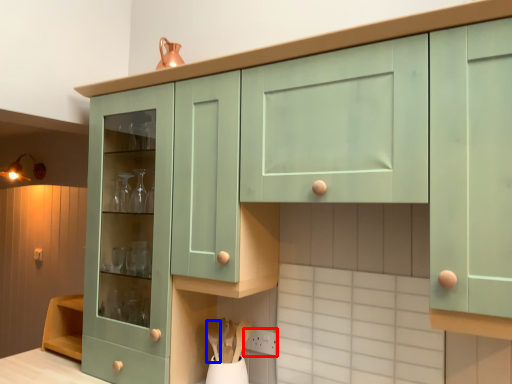
Question: Which point is further to the camera, power plugs and sockets (highlighted by a red box) or spoon (highlighted by a blue box)?

Choices:
 (A) power plugs and sockets
 (B) spoon

Answer: (A)